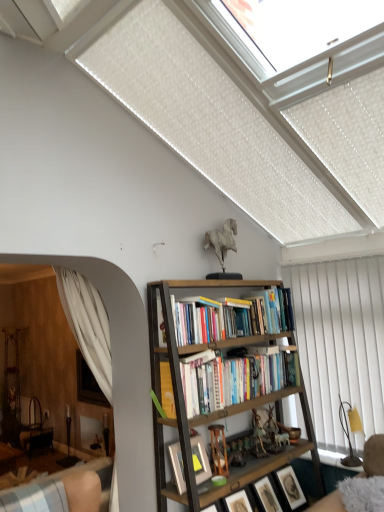
Question: Considering the relative sizes of white matte horse at upper center, acting as the first toy starting from the top, and metallic gold figurine at center, placed as the 2th toy when sorted from top to bottom, in the image provided, is white matte horse at upper center, acting as the first toy starting from the top, taller than metallic gold figurine at center, placed as the 2th toy when sorted from top to bottom,?

Choices:
 (A) yes
 (B) no

Answer: (A)

Question: Is the surface of white matte horse at upper center, acting as the 1th toy starting from the left, in direct contact with metallic gold figurine at center, placed as the 2th toy when sorted from left to right?

Choices:
 (A) yes
 (B) no

Answer: (B)

Question: Considering the relative sizes of white matte horse at upper center, the second toy from the bottom, and metallic gold figurine at center, placed as the 2th toy when sorted from left to right, in the image provided, is white matte horse at upper center, the second toy from the bottom, bigger than metallic gold figurine at center, placed as the 2th toy when sorted from left to right,?

Choices:
 (A) no
 (B) yes

Answer: (B)

Question: From a real-world perspective, is white matte horse at upper center, the second toy from the bottom, below metallic gold figurine at center, placed as the 2th toy when sorted from top to bottom?

Choices:
 (A) yes
 (B) no

Answer: (B)

Question: Would you say white matte horse at upper center, acting as the 1th toy starting from the left, is outside metallic gold figurine at center, placed as the 2th toy when sorted from left to right?

Choices:
 (A) yes
 (B) no

Answer: (A)

Question: From the image's perspective, is white matte horse at upper center, acting as the first toy starting from the top, on metallic gold figurine at center, acting as the first toy starting from the right?

Choices:
 (A) no
 (B) yes

Answer: (B)

Question: Is matte black picture frame at center, which ranks as the 3th picture frame in right-to-left order, positioned beyond the bounds of hardcover books at center?

Choices:
 (A) no
 (B) yes

Answer: (B)

Question: Can you confirm if matte black picture frame at center, which ranks as the 3th picture frame in right-to-left order, is taller than hardcover books at center?

Choices:
 (A) yes
 (B) no

Answer: (B)

Question: Considering the relative sizes of matte black picture frame at center, which ranks as the 3th picture frame in right-to-left order, and hardcover books at center in the image provided, is matte black picture frame at center, which ranks as the 3th picture frame in right-to-left order, shorter than hardcover books at center?

Choices:
 (A) no
 (B) yes

Answer: (B)

Question: Is matte black picture frame at center, which ranks as the 3th picture frame in right-to-left order, bigger than hardcover books at center?

Choices:
 (A) no
 (B) yes

Answer: (A)

Question: Considering the relative positions of matte black picture frame at center, which ranks as the 3th picture frame in right-to-left order, and hardcover books at center in the image provided, is matte black picture frame at center, which ranks as the 3th picture frame in right-to-left order, to the left of hardcover books at center from the viewer's perspective?

Choices:
 (A) no
 (B) yes

Answer: (B)

Question: From the image's perspective, would you say matte black picture frame at center, which ranks as the 3th picture frame in right-to-left order, is shown under hardcover books at center?

Choices:
 (A) yes
 (B) no

Answer: (A)

Question: Is matte black picture frame at center, which ranks as the 3th picture frame in right-to-left order, located within white matte horse at upper center, acting as the first toy starting from the top?

Choices:
 (A) yes
 (B) no

Answer: (B)